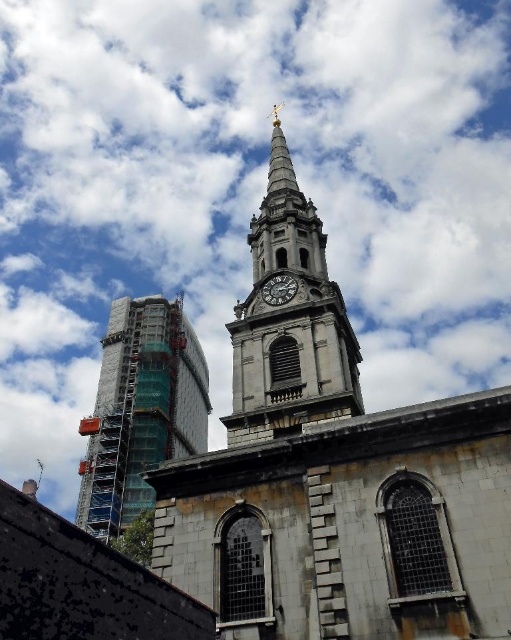
Who is shorter, stone clock tower at center or dark gray stone clock at center?

dark gray stone clock at center

Which is behind, point (276, 320) or point (286, 296)?

Positioned behind is point (286, 296).

Identify the location of stone clock tower at center. This screenshot has height=640, width=511. (290, 321).

Can you confirm if scaffolding glass at left is positioned to the left of dark gray stone clock at center?

Correct, you'll find scaffolding glass at left to the left of dark gray stone clock at center.

Which is more to the right, scaffolding glass at left or dark gray stone clock at center?

dark gray stone clock at center is more to the right.

Describe the element at coordinates (141, 410) in the screenshot. This screenshot has width=511, height=640. I see `scaffolding glass at left` at that location.

Find the location of a particular element. This screenshot has height=640, width=511. scaffolding glass at left is located at coordinates (141, 410).

Can you confirm if stone clock tower at center is smaller than scaffolding glass at left?

Incorrect, stone clock tower at center is not smaller in size than scaffolding glass at left.

Is point (294, 276) positioned behind point (121, 371)?

No.

Where is `stone clock tower at center`? The height and width of the screenshot is (640, 511). stone clock tower at center is located at coordinates (290, 321).